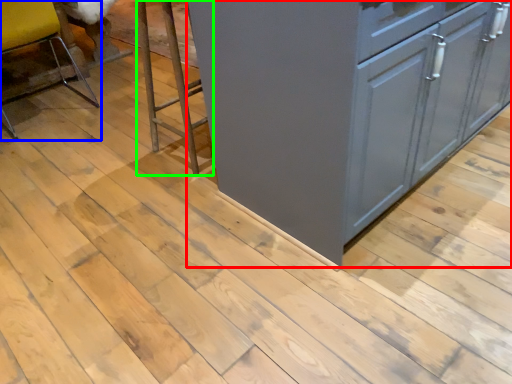
Question: Which object is the farthest from cabinetry (highlighted by a red box)? Choose among these: chair (highlighted by a blue box) or step stool (highlighted by a green box).

Choices:
 (A) chair
 (B) step stool

Answer: (A)